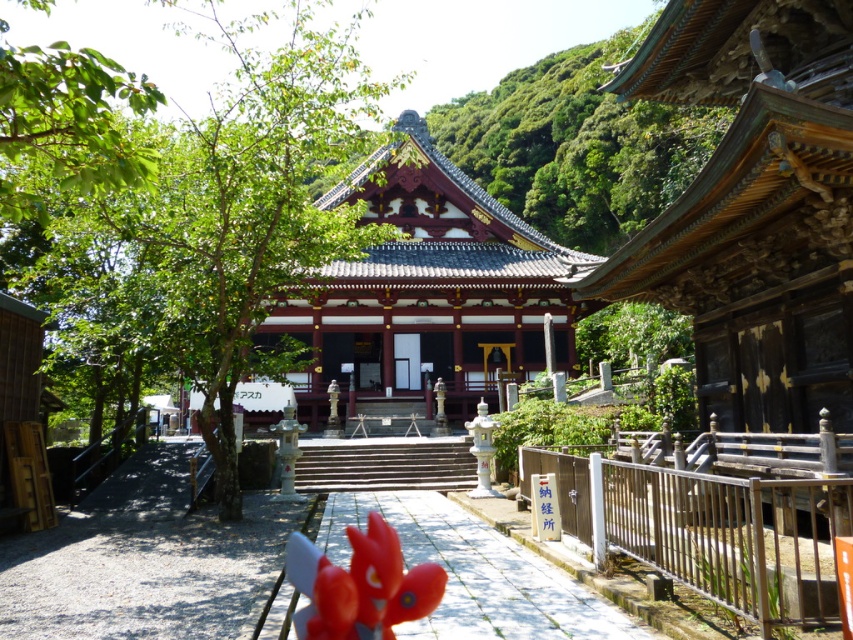
You are a visitor approaching the temple complex and see the green leafy tree at center and the shiny red wood pagoda at center. Which object is located to the left of the other?

The green leafy tree at center is positioned on the left side of shiny red wood pagoda at center.